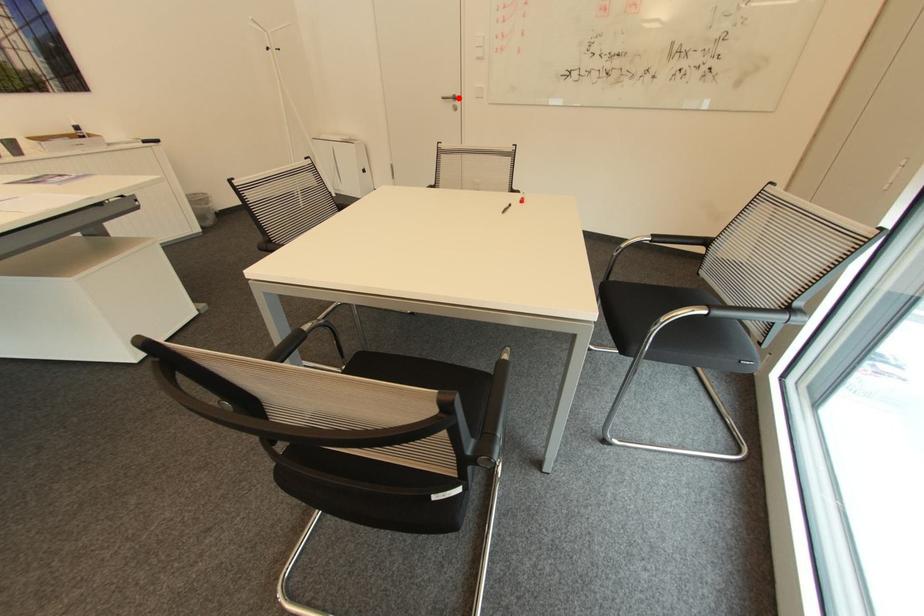
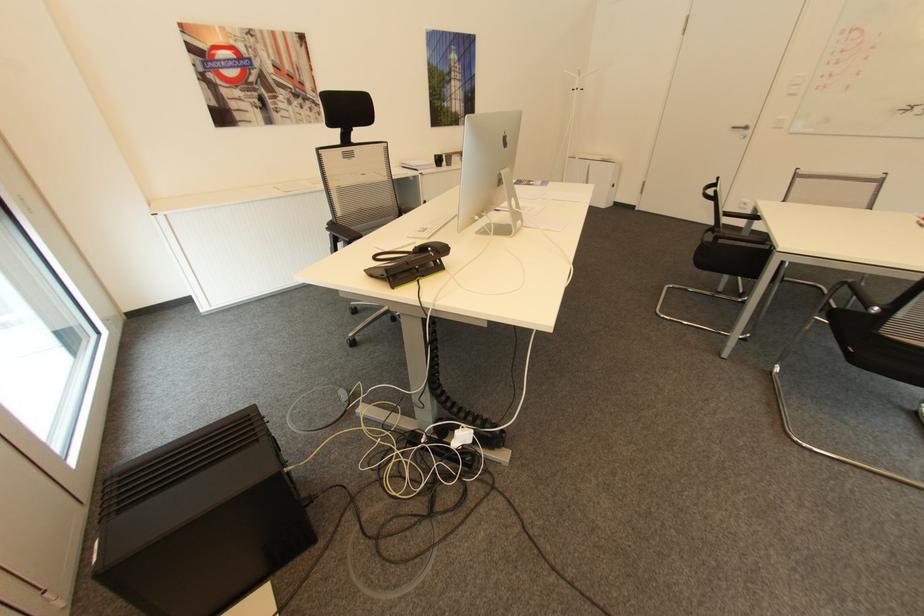
Question: I am providing you with two images of the same scene from different viewpoints. A red point is shown in image1. For the corresponding object point in image2, is it positioned nearer or farther from the camera?

Choices:
 (A) Nearer
 (B) Farther

Answer: (B)